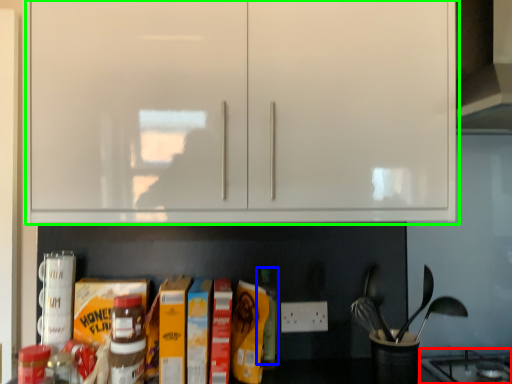
Question: Considering the real-world distances, which object is closest to gas stove (highlighted by a red box)? bottle (highlighted by a blue box) or cabinetry (highlighted by a green box).

Choices:
 (A) bottle
 (B) cabinetry

Answer: (A)